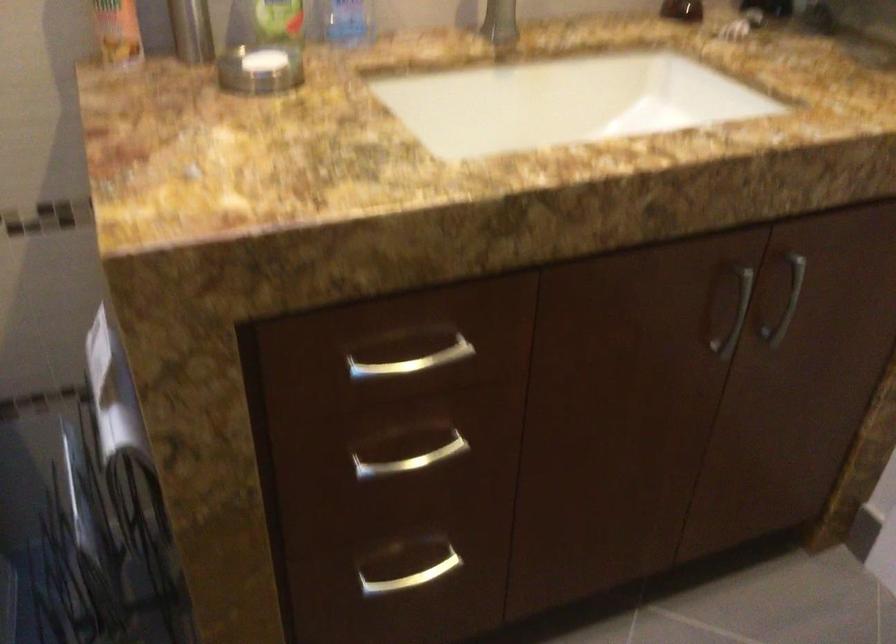
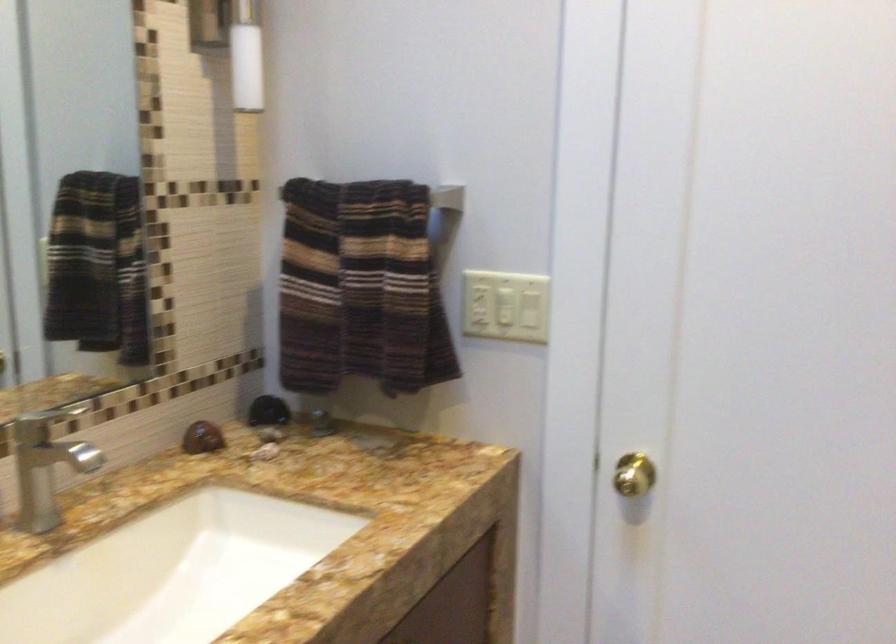
Question: The camera is either moving clockwise (left) or counter-clockwise (right) around the object. The first image is from the beginning of the video and the second image is from the end. Is the camera moving left or right when shooting the video?

Choices:
 (A) Left
 (B) Right

Answer: (A)